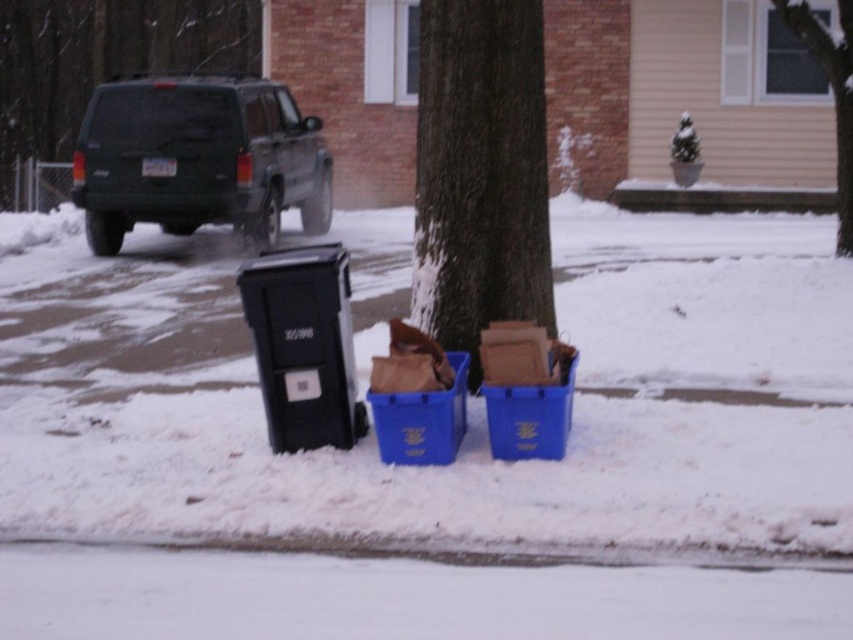
Question: Does dark green matte suv at upper left lie in front of smooth bark tree at upper center?

Choices:
 (A) no
 (B) yes

Answer: (A)

Question: Among these objects, which one is farthest from the camera?

Choices:
 (A) green matte suv at upper left
 (B) brown paper bag at lower center
 (C) smooth bark tree at upper center

Answer: (A)

Question: Among these points, which one is nearest to the camera?

Choices:
 (A) (811, 12)
 (B) (169, 122)
 (C) (349, 408)

Answer: (C)

Question: Is snowy concrete pavement at lower center smaller than brown rough bark at center?

Choices:
 (A) yes
 (B) no

Answer: (B)

Question: Is green matte suv at upper left positioned before black plastic recycling bin at lower left?

Choices:
 (A) no
 (B) yes

Answer: (A)

Question: Which of the following is the farthest from the observer?

Choices:
 (A) green matte suv at upper left
 (B) brown paper bag at lower center
 (C) smooth bark tree at upper center

Answer: (A)